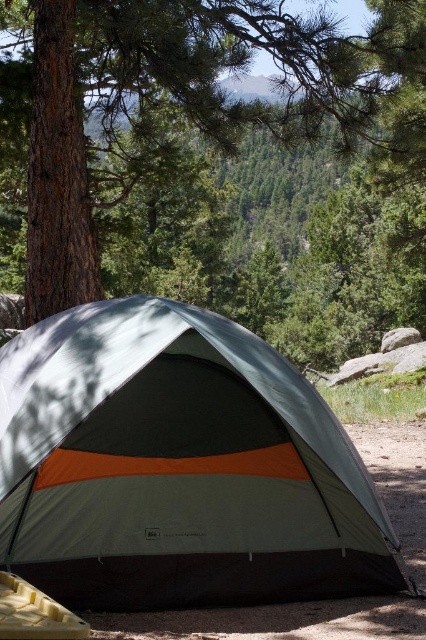
Identify the location of green rough bark tree at center. This screenshot has width=426, height=640. (204, 148).

What do you see at coordinates (204, 148) in the screenshot? I see `green rough bark tree at center` at bounding box center [204, 148].

Where is `green rough bark tree at center`? green rough bark tree at center is located at coordinates (204, 148).